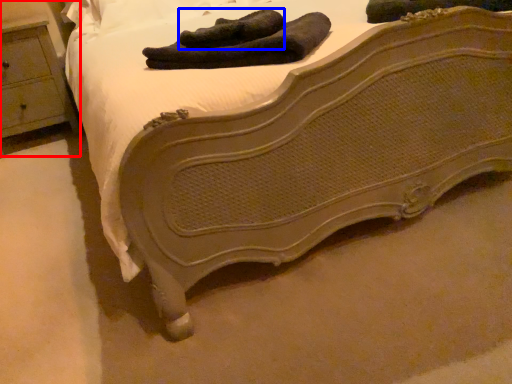
Question: Among these objects, which one is nearest to the camera, nightstand (highlighted by a red box) or footwear (highlighted by a blue box)?

Choices:
 (A) nightstand
 (B) footwear

Answer: (B)